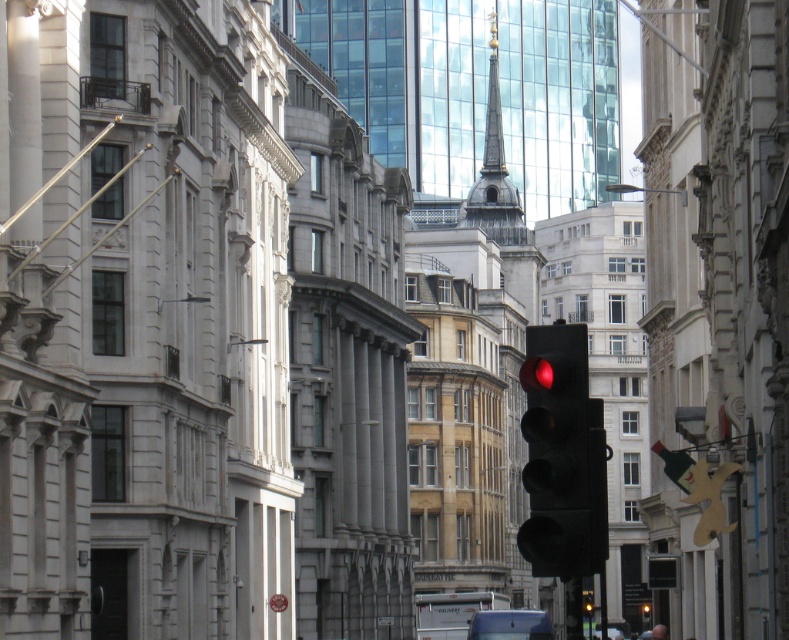
From the picture: Does blue metallic van at lower center have a greater height compared to metallic silver car at lower right?

Incorrect, blue metallic van at lower center's height is not larger of metallic silver car at lower right's.

Which is below, blue metallic van at lower center or metallic silver car at lower right?

metallic silver car at lower right is below.

Locate an element on the screen. The width and height of the screenshot is (789, 640). blue metallic van at lower center is located at coordinates (510, 625).

Locate an element on the screen. This screenshot has height=640, width=789. blue metallic van at lower center is located at coordinates (510, 625).

Looking at this image, is black matte traffic light at center positioned in front of blue metallic van at lower center?

That is True.

Which of these two, black matte traffic light at center or blue metallic van at lower center, stands shorter?

blue metallic van at lower center

Which is behind, point (548, 572) or point (541, 614)?

Point (541, 614)

At what (x,y) coordinates should I click in order to perform the action: click on black matte traffic light at center. Please return your answer as a coordinate pair (x, y). The height and width of the screenshot is (640, 789). Looking at the image, I should click on (563, 456).

Can you confirm if black matte traffic light at center is thinner than metallic silver car at lower right?

Indeed, black matte traffic light at center has a lesser width compared to metallic silver car at lower right.

This screenshot has height=640, width=789. What are the coordinates of `black matte traffic light at center` in the screenshot? It's located at (563, 456).

Locate an element on the screen. black matte traffic light at center is located at coordinates (563, 456).